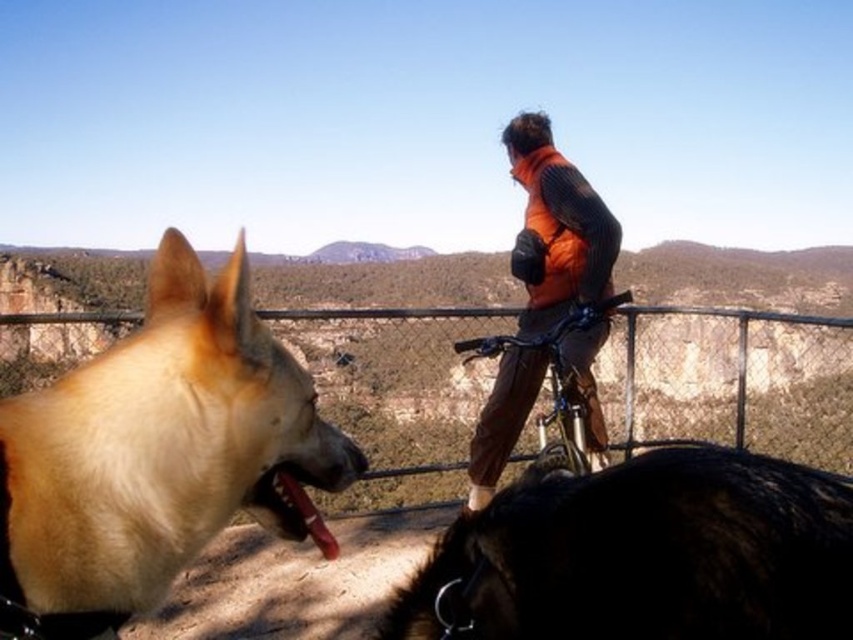
You are a photographer trying to capture a photo of the black fur dog at lower right and the metal wire fence at center. Which object should you focus on first if you want to ensure both are in the frame without moving the camera?

You should focus on the metal wire fence at center first because it is larger than the black fur dog at lower right, making it easier to locate and frame initially.